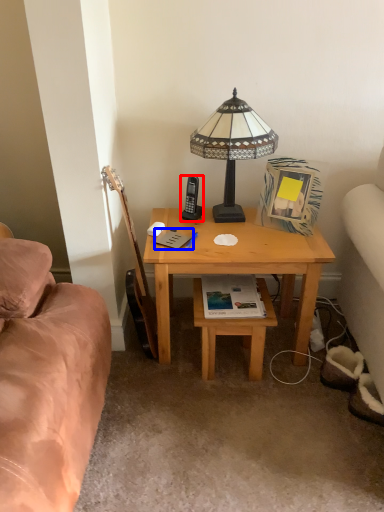
Question: Which point is further to the camera, mobile phone (highlighted by a red box) or book (highlighted by a blue box)?

Choices:
 (A) mobile phone
 (B) book

Answer: (A)